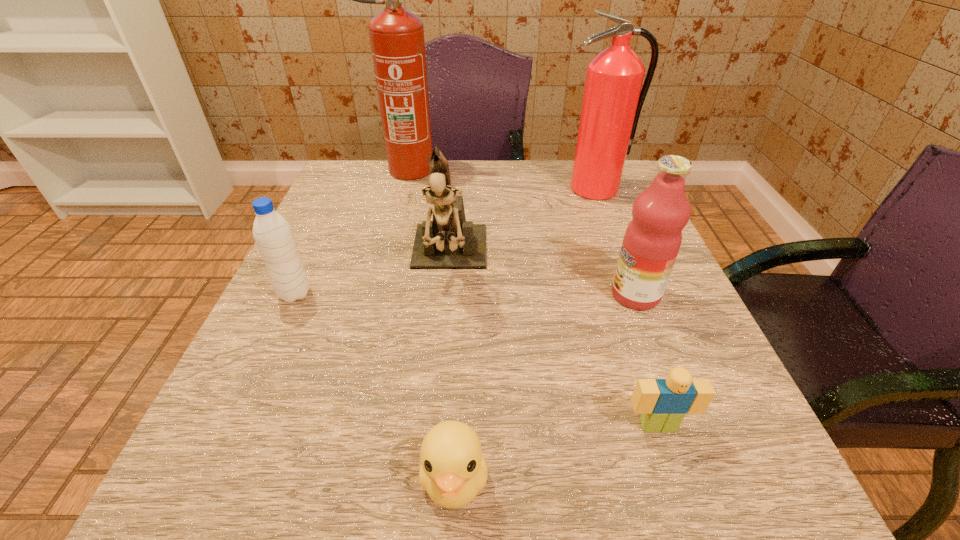
Locate an element on the screen. The width and height of the screenshot is (960, 540). the left fire extinguisher is located at coordinates (397, 41).

Locate an element on the screen. The image size is (960, 540). the taller fire extinguisher is located at coordinates (397, 41).

Find the location of a particular element. the right fire extinguisher is located at coordinates (612, 102).

Find the location of a particular element. This screenshot has width=960, height=540. the shorter fire extinguisher is located at coordinates (612, 102).

Image resolution: width=960 pixels, height=540 pixels. I want to click on figurine, so click(x=449, y=241).

You are a GUI agent. You are given a task and a screenshot of the screen. Output one action in this format:
    pyautogui.click(x=<x>, y=<y>)
    Task: Click on the fruit juice
    This screenshot has width=960, height=540.
    Given the screenshot: What is the action you would take?
    pyautogui.click(x=652, y=240)

Identify the location of the fifth tallest object. This screenshot has width=960, height=540. (273, 235).

What are the coordinates of `the sixth farthest object` in the screenshot? It's located at (663, 403).

Image resolution: width=960 pixels, height=540 pixels. In order to click on the nearest object in this screenshot , I will do `click(453, 470)`.

The width and height of the screenshot is (960, 540). I want to click on vacant space situated 0.100m from the nozzle of the left fire extinguisher, so click(481, 171).